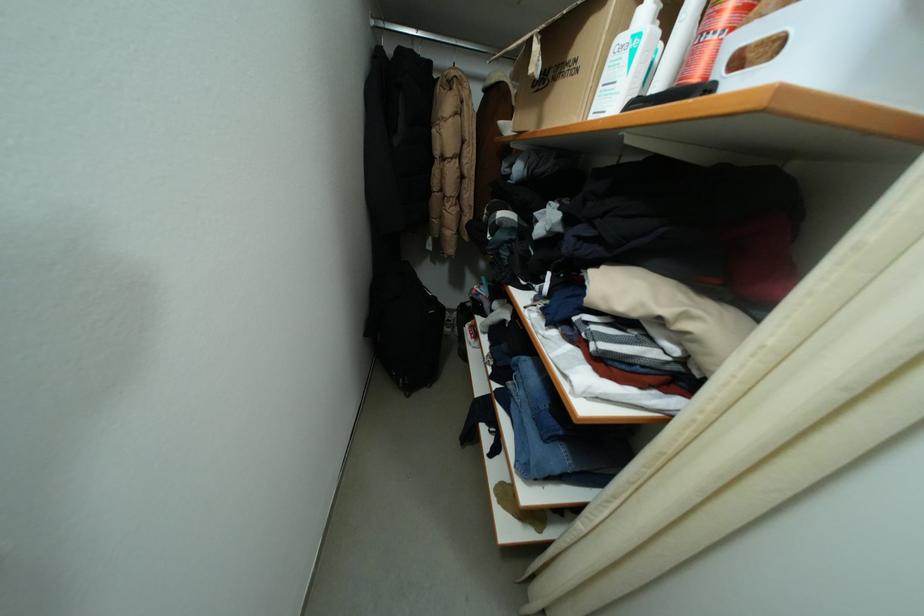
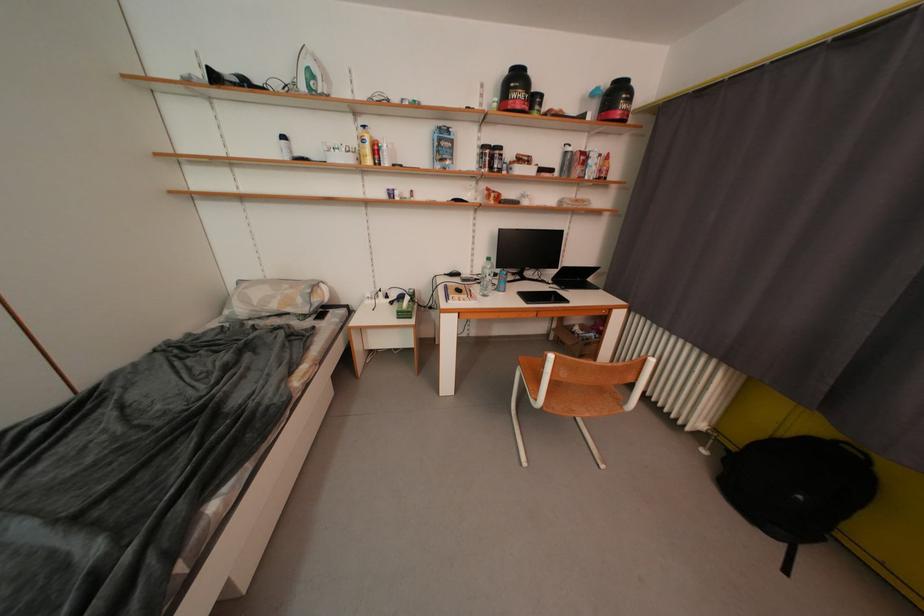
Question: In a continuous first-person perspective shot, in which direction is the camera moving?

Choices:
 (A) Left
 (B) Right
 (C) Forward
 (D) Backward

Answer: (B)